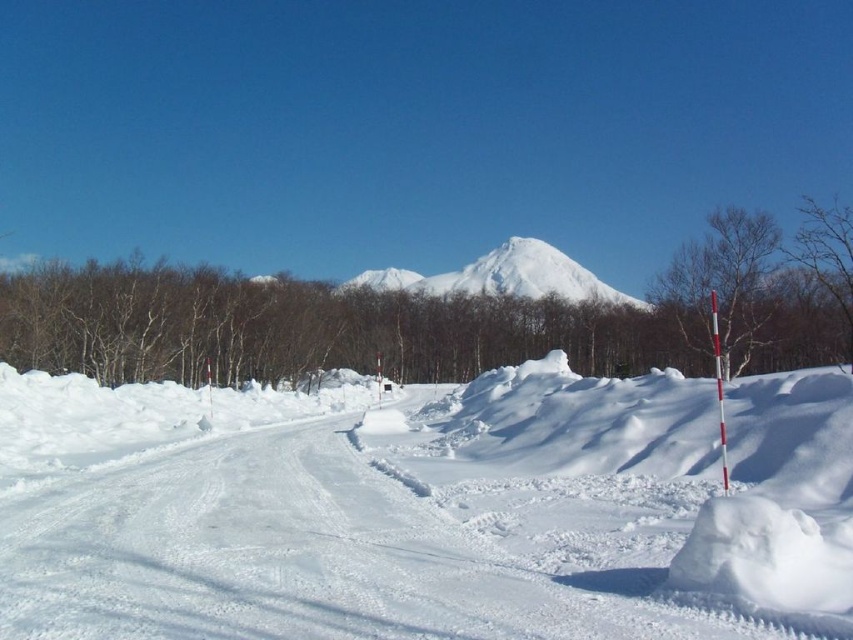
Which is below, white snow at center or bare branches at upper right?

Positioned lower is white snow at center.

Can you confirm if white snow at center is wider than bare branches at upper right?

No.

Is point (676, 548) positioned before point (834, 220)?

Yes.

Where is `white snow at center`? The image size is (853, 640). white snow at center is located at coordinates (426, 509).

Which is behind, point (537, 252) or point (851, 346)?

Point (537, 252)

This screenshot has height=640, width=853. Describe the element at coordinates (505, 276) in the screenshot. I see `white snow-covered mountain at center` at that location.

Locate an element on the screen. The height and width of the screenshot is (640, 853). white snow-covered mountain at center is located at coordinates (505, 276).

Is bare wood tree at right behind white snow-covered mountain at center?

No.

Does bare wood tree at right appear under white snow-covered mountain at center?

Yes.

Is point (758, 323) farther from camera compared to point (405, 269)?

No, it is in front of (405, 269).

The image size is (853, 640). In order to click on bare wood tree at right in this screenshot , I will do `click(723, 284)`.